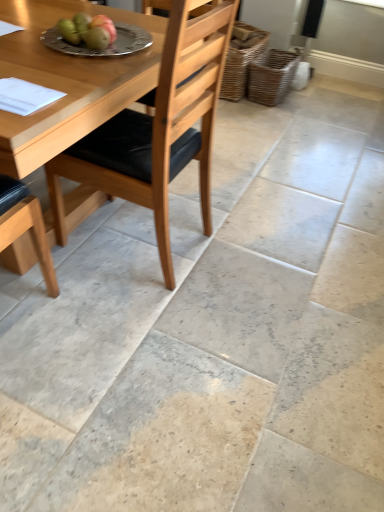
What is the approximate width of green matte pear at upper left, which appears as the 2th fruit when viewed from the left?

4.81 inches.

Image resolution: width=384 pixels, height=512 pixels. What are the coordinates of `green matte apple at upper left, the 2th fruit from the right` in the screenshot? It's located at (69, 31).

Locate an element on the screen. The image size is (384, 512). woven brown basket at lower right, arranged as the first basket when viewed from the right is located at coordinates (271, 76).

In order to face white paper at upper left, should I rotate leftwards or rightwards?

Turn left by 22.394 degrees to look at white paper at upper left.

What do you see at coordinates (241, 59) in the screenshot?
I see `woven brown basket at center, which is the 2th basket from right to left` at bounding box center [241, 59].

Where is `green matte pear at upper left, which is the first fruit in right-to-left order`? The image size is (384, 512). green matte pear at upper left, which is the first fruit in right-to-left order is located at coordinates click(96, 37).

Looking at this image, what's the angular difference between green matte pear at upper left, which is the first fruit in right-to-left order, and white paper at upper left's facing directions?

The angular difference between green matte pear at upper left, which is the first fruit in right-to-left order, and white paper at upper left is 106 degrees.

Is green matte pear at upper left, which appears as the 2th fruit when viewed from the left, positioned in front of white paper at upper left?

No, it is not.

From a real-world perspective, which object rests below the other?

white paper at upper left, from a real-world perspective.

Is green matte pear at upper left, which appears as the 2th fruit when viewed from the left, next to white paper at upper left?

No, green matte pear at upper left, which appears as the 2th fruit when viewed from the left, is not making contact with white paper at upper left.

Between point (254, 86) and point (73, 35), which one is positioned behind?

Point (254, 86)

Which fruit is the 1st one when counting from the front of the woven brown basket at lower right, the 2th basket positioned from the left? Please provide its 2D coordinates.

[(69, 31)]

Between woven brown basket at lower right, the 2th basket positioned from the left, and green matte apple at upper left, which ranks as the first fruit in left-to-right order, which one has more height?

With more height is woven brown basket at lower right, the 2th basket positioned from the left.

Considering the relative sizes of woven brown basket at lower right, arranged as the first basket when viewed from the right, and green matte apple at upper left, which ranks as the first fruit in left-to-right order, in the image provided, is woven brown basket at lower right, arranged as the first basket when viewed from the right, bigger than green matte apple at upper left, which ranks as the first fruit in left-to-right order,?

Yes, woven brown basket at lower right, arranged as the first basket when viewed from the right, is bigger than green matte apple at upper left, which ranks as the first fruit in left-to-right order.

Which object is more forward, woven brown basket at center, the 1th basket viewed from the left, or green matte apple at upper left, the 2th fruit from the right?

green matte apple at upper left, the 2th fruit from the right, is closer to the camera.

Find the location of a particular element. fruit that is the 1st one when counting forward from the woven brown basket at center, which is the 2th basket from right to left is located at coordinates (69, 31).

From a real-world perspective, which is physically below, woven brown basket at center, the 1th basket viewed from the left, or green matte apple at upper left, the 2th fruit from the right?

From a 3D spatial view, woven brown basket at center, the 1th basket viewed from the left, is below.

Looking at their sizes, would you say woven brown basket at center, which is the 2th basket from right to left, is wider or thinner than green matte apple at upper left, which ranks as the first fruit in left-to-right order?

woven brown basket at center, which is the 2th basket from right to left, is wider than green matte apple at upper left, which ranks as the first fruit in left-to-right order.

Which of these two, woven brown basket at center, the 1th basket viewed from the left, or white paper at upper left, is bigger?

Bigger between the two is woven brown basket at center, the 1th basket viewed from the left.

Where is `notepad in front of the woven brown basket at center, the 1th basket viewed from the left`? notepad in front of the woven brown basket at center, the 1th basket viewed from the left is located at coordinates (25, 96).

Would you consider woven brown basket at center, which is the 2th basket from right to left, to be distant from white paper at upper left?

Absolutely, woven brown basket at center, which is the 2th basket from right to left, is distant from white paper at upper left.

Does white paper at upper left turn towards green matte apple at upper left, which ranks as the first fruit in left-to-right order?

No, white paper at upper left is not oriented towards green matte apple at upper left, which ranks as the first fruit in left-to-right order.

Is green matte apple at upper left, which ranks as the first fruit in left-to-right order, inside white paper at upper left?

That's incorrect, green matte apple at upper left, which ranks as the first fruit in left-to-right order, is not inside white paper at upper left.

From the picture: Looking at their sizes, would you say white paper at upper left is wider or thinner than green matte apple at upper left, which ranks as the first fruit in left-to-right order?

Clearly, white paper at upper left has more width compared to green matte apple at upper left, which ranks as the first fruit in left-to-right order.

Between green matte apple at upper left, the 2th fruit from the right, and white paper at upper left, which one has smaller width?

green matte apple at upper left, the 2th fruit from the right.

From a real-world perspective, is green matte apple at upper left, the 2th fruit from the right, physically located above or below white paper at upper left?

Clearly, from a real-world perspective, green matte apple at upper left, the 2th fruit from the right, is above white paper at upper left.

Do you think green matte pear at upper left, which is the first fruit in right-to-left order, is within woven brown basket at lower right, the 2th basket positioned from the left, or outside of it?

green matte pear at upper left, which is the first fruit in right-to-left order, is not inside woven brown basket at lower right, the 2th basket positioned from the left, it's outside.

Can you confirm if green matte pear at upper left, which is the first fruit in right-to-left order, is shorter than woven brown basket at lower right, arranged as the first basket when viewed from the right?

Yes, green matte pear at upper left, which is the first fruit in right-to-left order, is shorter than woven brown basket at lower right, arranged as the first basket when viewed from the right.

Can you confirm if green matte pear at upper left, which appears as the 2th fruit when viewed from the left, is wider than woven brown basket at lower right, the 2th basket positioned from the left?

In fact, green matte pear at upper left, which appears as the 2th fruit when viewed from the left, might be narrower than woven brown basket at lower right, the 2th basket positioned from the left.

Is green matte pear at upper left, which is the first fruit in right-to-left order, looking in the opposite direction of woven brown basket at lower right, the 2th basket positioned from the left?

green matte pear at upper left, which is the first fruit in right-to-left order, is not turned away from woven brown basket at lower right, the 2th basket positioned from the left.

At what (x,y) coordinates should I click in order to perform the action: click on the 2nd fruit located above the white paper at upper left (from a real-world perspective). Please return your answer as a coordinate pair (x, y). Image resolution: width=384 pixels, height=512 pixels. Looking at the image, I should click on (96, 37).

From the woven brown basket at lower right, the 2th basket positioned from the left, count the 2nd fruit to the left and point to it. Please provide its 2D coordinates.

[(69, 31)]

Estimate the real-world distances between objects in this image. Which object is further from white paper at upper left, natural wood chair at center or woven brown basket at center, the 1th basket viewed from the left?

woven brown basket at center, the 1th basket viewed from the left, is positioned further to the anchor white paper at upper left.

Which object lies further to the anchor point green matte apple at upper left, the 2th fruit from the right, white paper at upper left or woven brown basket at center, the 1th basket viewed from the left?

woven brown basket at center, the 1th basket viewed from the left, lies further to green matte apple at upper left, the 2th fruit from the right, than the other object.

Based on their spatial positions, is silver metallic plate at upper center or woven brown basket at lower right, the 2th basket positioned from the left, closer to natural wood chair at center?

silver metallic plate at upper center is positioned closer to the anchor natural wood chair at center.

Estimate the real-world distances between objects in this image. Which object is closer to green matte pear at upper left, which is the first fruit in right-to-left order, white paper at upper left or silver metallic plate at upper center?

silver metallic plate at upper center.

When comparing their distances from woven brown basket at center, the 1th basket viewed from the left, does white paper at upper left or woven brown basket at lower right, arranged as the first basket when viewed from the right, seem further?

white paper at upper left.

Estimate the real-world distances between objects in this image. Which object is further from green matte apple at upper left, the 2th fruit from the right, woven brown basket at lower right, the 2th basket positioned from the left, or natural wood chair at center?

woven brown basket at lower right, the 2th basket positioned from the left, is further to green matte apple at upper left, the 2th fruit from the right.

Based on their spatial positions, is green matte apple at upper left, which ranks as the first fruit in left-to-right order, or silver metallic plate at upper center further from woven brown basket at center, the 1th basket viewed from the left?

green matte apple at upper left, which ranks as the first fruit in left-to-right order, lies further to woven brown basket at center, the 1th basket viewed from the left, than the other object.

Considering their positions, is white paper at upper left positioned closer to natural wood chair at center than silver metallic plate at upper center?

Based on the image, silver metallic plate at upper center appears to be nearer to natural wood chair at center.

Identify the location of basket positioned between white paper at upper left and woven brown basket at lower right, arranged as the first basket when viewed from the right, from near to far. (241, 59).

Locate an element on the screen. fruit positioned between green matte pear at upper left, which appears as the 2th fruit when viewed from the left, and woven brown basket at center, the 1th basket viewed from the left, from near to far is located at coordinates (69, 31).

Find the location of a particular element. basket located between green matte pear at upper left, which appears as the 2th fruit when viewed from the left, and woven brown basket at lower right, the 2th basket positioned from the left, in the depth direction is located at coordinates (241, 59).

The height and width of the screenshot is (512, 384). What are the coordinates of `plate positioned between natural wood chair at center and woven brown basket at lower right, the 2th basket positioned from the left, from near to far` in the screenshot? It's located at (105, 49).